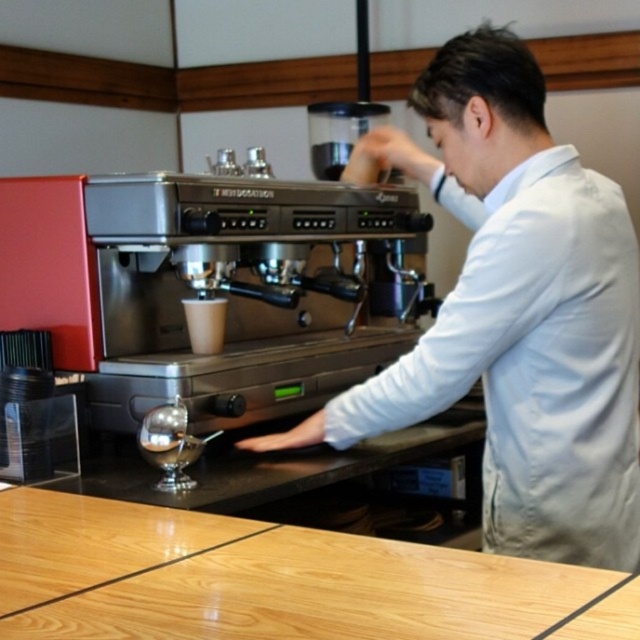
Question: Which object is closer to the camera taking this photo?

Choices:
 (A) metallic silver espresso machine at center
 (B) wooden at center

Answer: (B)

Question: Considering the relative positions of metallic silver espresso machine at center and wooden at center in the image provided, where is metallic silver espresso machine at center located with respect to wooden at center?

Choices:
 (A) right
 (B) left

Answer: (A)

Question: Is metallic silver espresso machine at center smaller than wooden at center?

Choices:
 (A) no
 (B) yes

Answer: (A)

Question: Can you confirm if metallic silver espresso machine at center is wider than wooden at center?

Choices:
 (A) yes
 (B) no

Answer: (A)

Question: Which point is farther to the camera?

Choices:
 (A) (461, 636)
 (B) (86, 340)

Answer: (B)